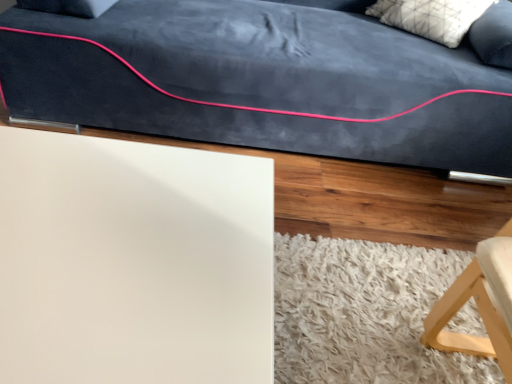
Identify the location of free point above white matte board at lower left (from a real-world perspective). (117, 218).